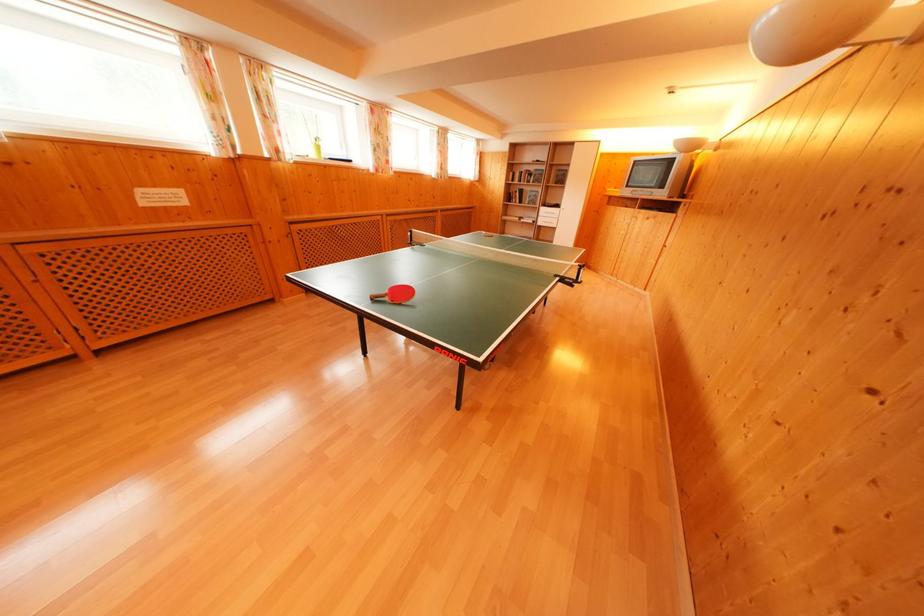
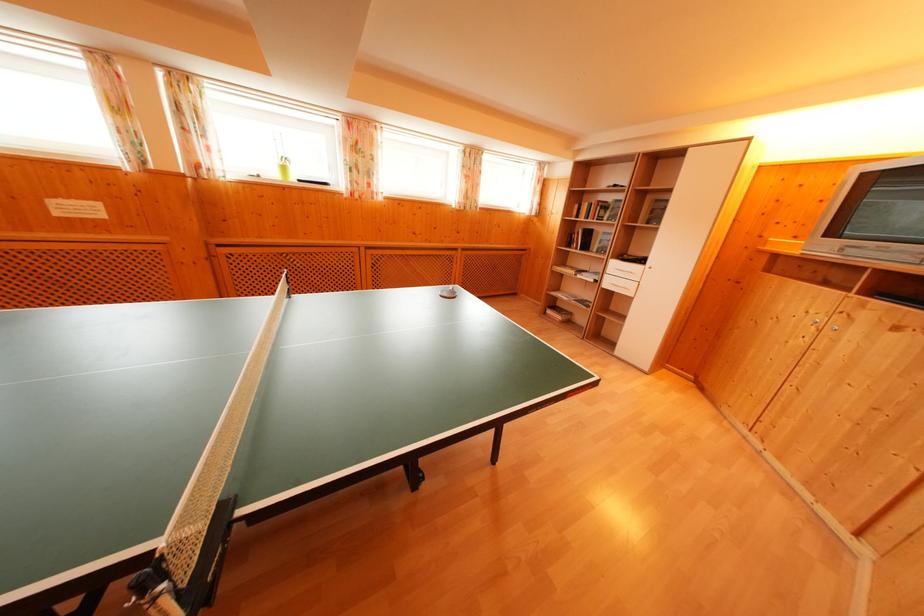
Find the pixel in the second image that matches (x=323, y=153) in the first image.

(288, 174)